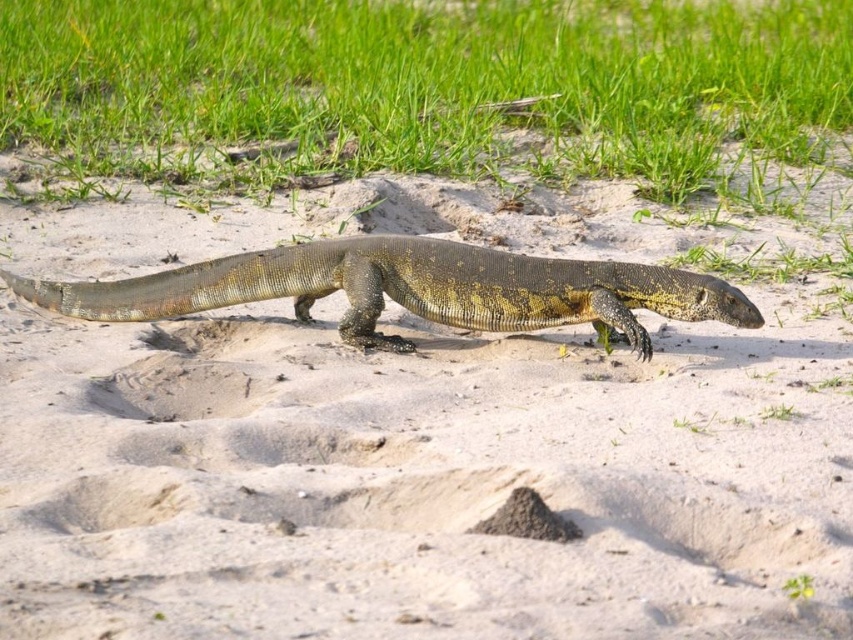
Question: Is green grass at upper center thinner than brown scaly lizard at center?

Choices:
 (A) no
 (B) yes

Answer: (B)

Question: Among these points, which one is nearest to the camera?

Choices:
 (A) (387, 289)
 (B) (148, 96)

Answer: (A)

Question: Which point is farther to the camera?

Choices:
 (A) (218, 292)
 (B) (814, 81)

Answer: (B)

Question: Which point is farther to the camera?

Choices:
 (A) (218, 51)
 (B) (267, 288)

Answer: (A)

Question: Can you confirm if green grass at upper center is wider than brown scaly lizard at center?

Choices:
 (A) no
 (B) yes

Answer: (A)

Question: Can you confirm if green grass at upper center is wider than brown scaly lizard at center?

Choices:
 (A) no
 (B) yes

Answer: (A)